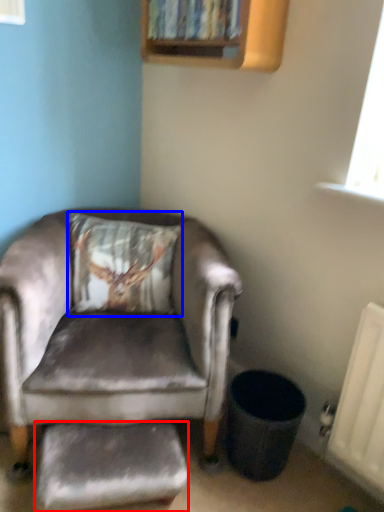
Question: Which point is further to the camera, footrest (highlighted by a red box) or pillow (highlighted by a blue box)?

Choices:
 (A) footrest
 (B) pillow

Answer: (B)